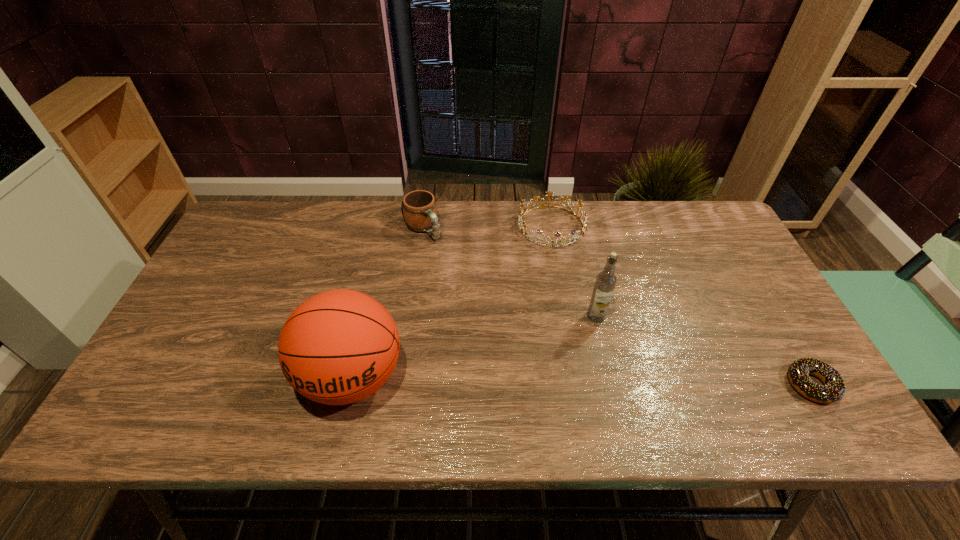
In order to click on vacant region located 0.330m on the side of the third tallest object with the handle in this screenshot , I will do `click(491, 312)`.

Find the location of `free space located on the side of the third tallest object with the handle`. free space located on the side of the third tallest object with the handle is located at coordinates (455, 269).

The image size is (960, 540). What are the coordinates of `vacant area situated 0.280m on the side of the third tallest object with the handle` in the screenshot? It's located at (481, 300).

Find the location of a particular element. free space located on the front-facing side of the tiara is located at coordinates (561, 281).

Find the location of a particular element. The width and height of the screenshot is (960, 540). free space located on the front-facing side of the tiara is located at coordinates (572, 352).

Identify the location of free region located on the front-facing side of the tiara. This screenshot has width=960, height=540. [x=567, y=322].

Find the location of a particular element. The image size is (960, 540). mug that is at the far edge is located at coordinates (419, 207).

What are the coordinates of `tiara present at the far edge` in the screenshot? It's located at (x=522, y=224).

Locate an element on the screen. Image resolution: width=960 pixels, height=540 pixels. basketball situated at the near edge is located at coordinates (338, 347).

Locate an element on the screen. doughnut present at the near edge is located at coordinates (834, 389).